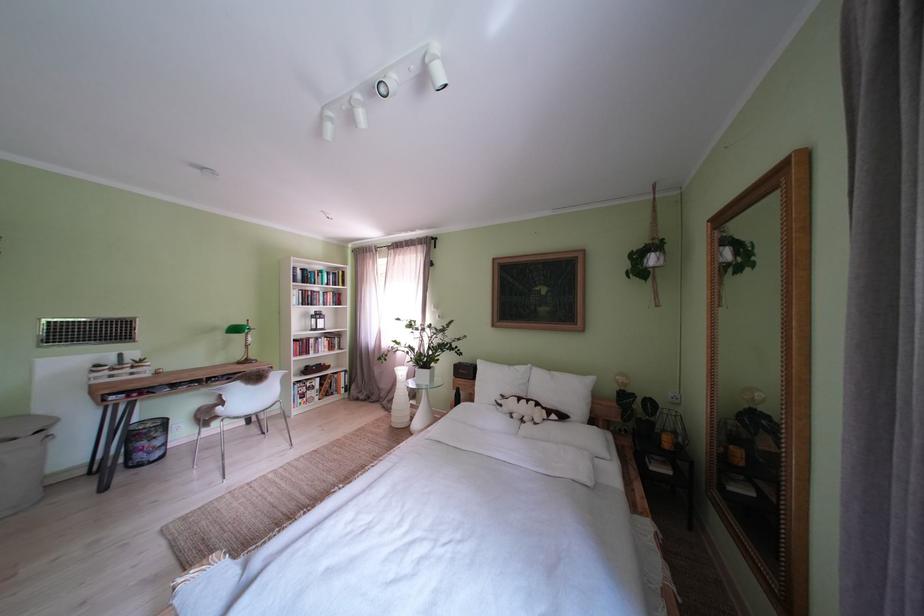
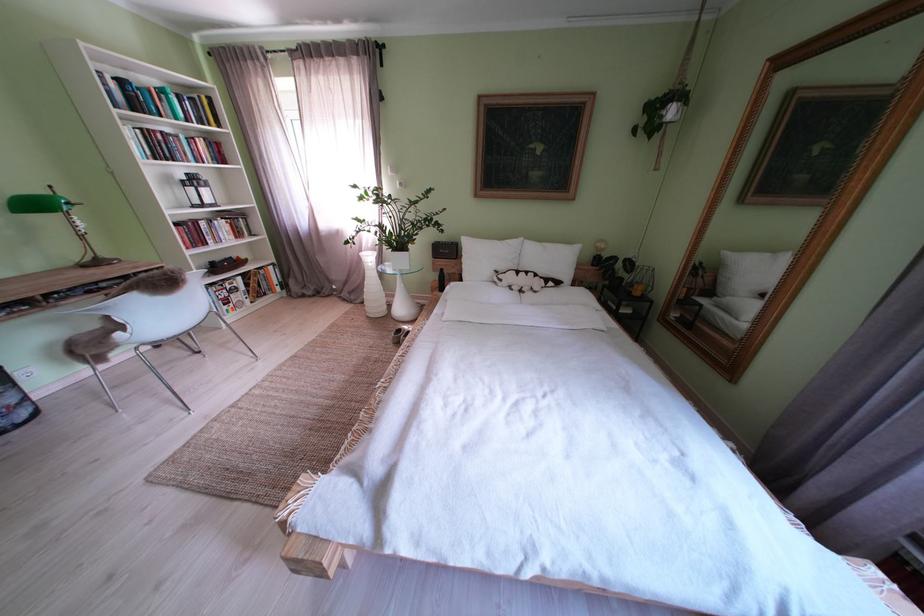
Find the pixel in the second image that matches (512,411) in the first image.

(512, 285)